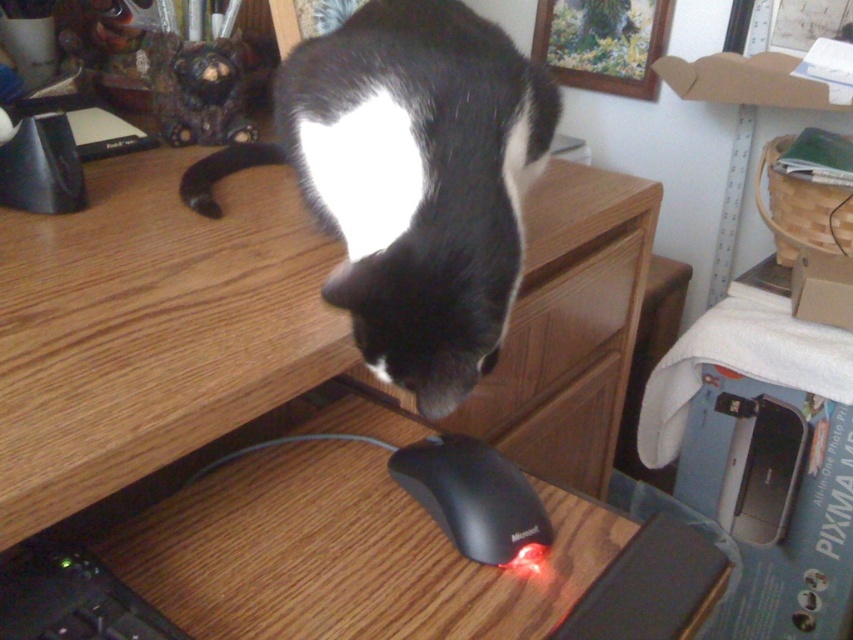
Does black plastic mouse at lower center appear over black matte keyboard at lower left?

Correct, black plastic mouse at lower center is located above black matte keyboard at lower left.

Between black plastic mouse at lower center and black matte keyboard at lower left, which one has more height?

With more height is black plastic mouse at lower center.

Between point (486, 540) and point (47, 557), which one is positioned behind?

The point (486, 540) is more distant.

Image resolution: width=853 pixels, height=640 pixels. In order to click on black plastic mouse at lower center in this screenshot , I will do `click(474, 499)`.

Is point (648, 212) closer to viewer compared to point (28, 595)?

No, it is not.

I want to click on wooden at center, so tap(149, 332).

Is black matte fur cat at center positioned at the back of black matte keyboard at lower left?

That is True.

Is black matte fur cat at center below black matte keyboard at lower left?

No, black matte fur cat at center is not below black matte keyboard at lower left.

Is point (426, 104) more distant than point (138, 602)?

Yes, point (426, 104) is farther from viewer.

Locate an element on the screen. black matte fur cat at center is located at coordinates (410, 180).